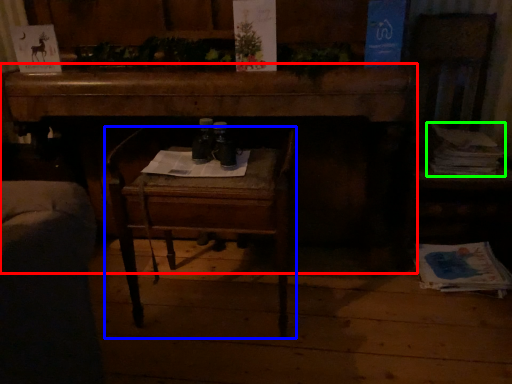
Question: Which object is positioned closest to desk (highlighted by a red box)? Select from chair (highlighted by a blue box) and magazine (highlighted by a green box).

Choices:
 (A) chair
 (B) magazine

Answer: (A)